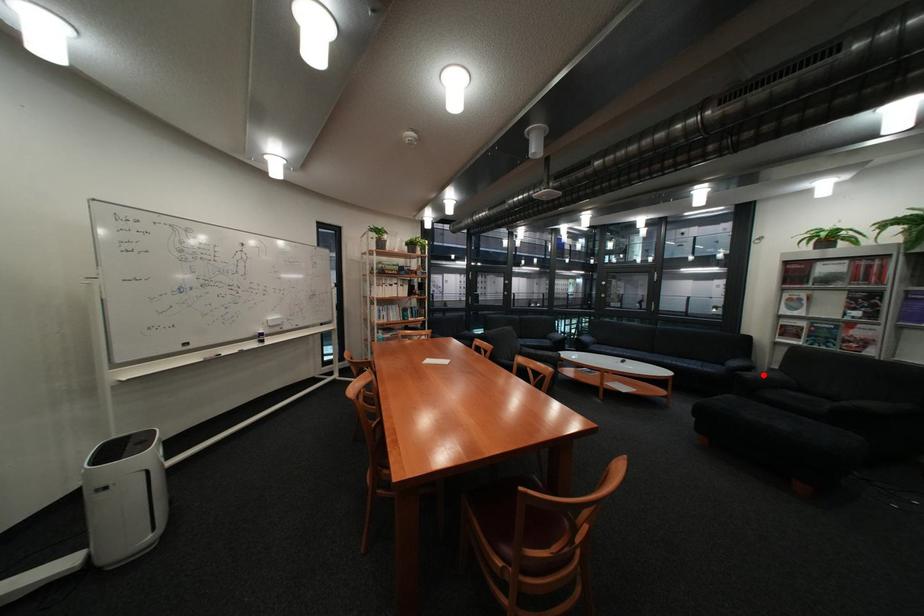
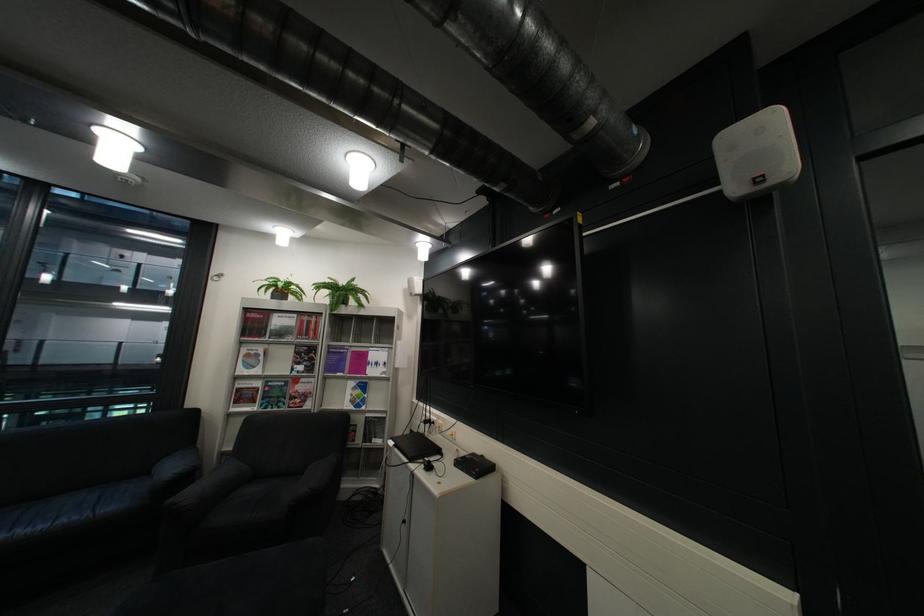
Question: I am providing you with two images of the same scene from different viewpoints. Given a red point in image1, look at the same physical point in image2. Is it:

Choices:
 (A) Closer to the viewpoint
 (B) Farther from the viewpoint

Answer: (B)